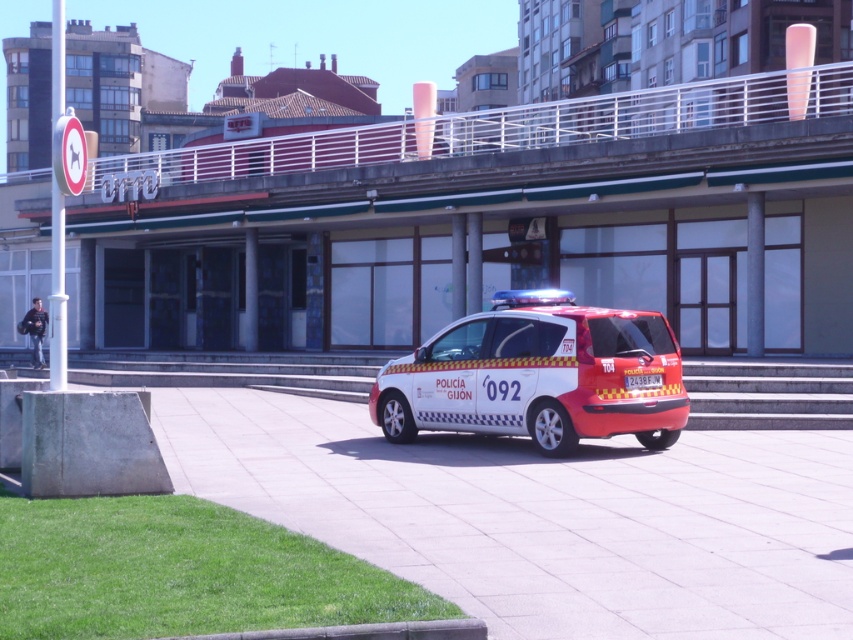
You are a delivery driver who needs to park your truck in this area. The parking space you want is located at point coordinates of 0.588, 0.631. Is the white glossy police car at center currently occupying that parking space?

The white glossy police car at center is located at point coordinates of (537, 376), so yes, it is occupying that parking space.

Based on the photo, you are standing in the urban scene and want to reach the point marked at coordinates (433, 360). Given that the police car is between you and this point, can you safely walk around the police car to reach it?

The point marked at coordinates (433, 360) is 15.62 meters away from the viewer. Since the police car is between you and the point, you can safely walk around the police car to reach it as long as there is enough space around the vehicle. However, the distance provided does not specify the exact positioning relative to the police car, so caution is advised.

You are a delivery person trying to park your bike between the white tile pavement at center and the white plastic license plate at center. Which area should you choose to ensure your bike fits properly?

The white tile pavement at center has a larger size compared to the white plastic license plate at center, so you should choose the white tile pavement at center to park your bike as it provides more space.